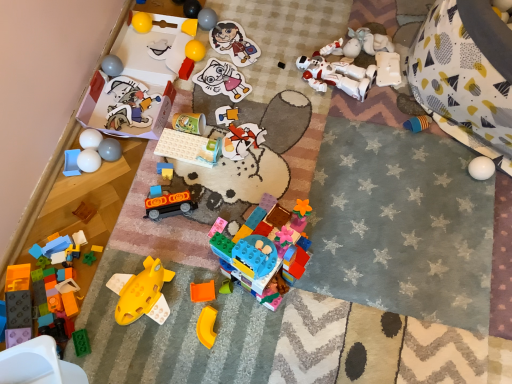
The width and height of the screenshot is (512, 384). What are the coordinates of `space that is in front of white matte robot at center, marked as the third toy in a right-to-left arrangement` in the screenshot? It's located at (339, 130).